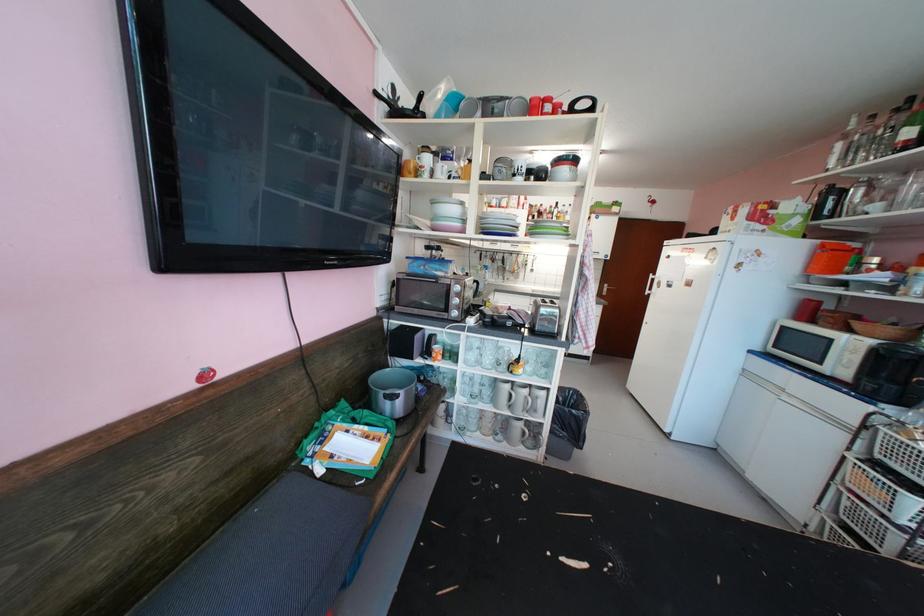
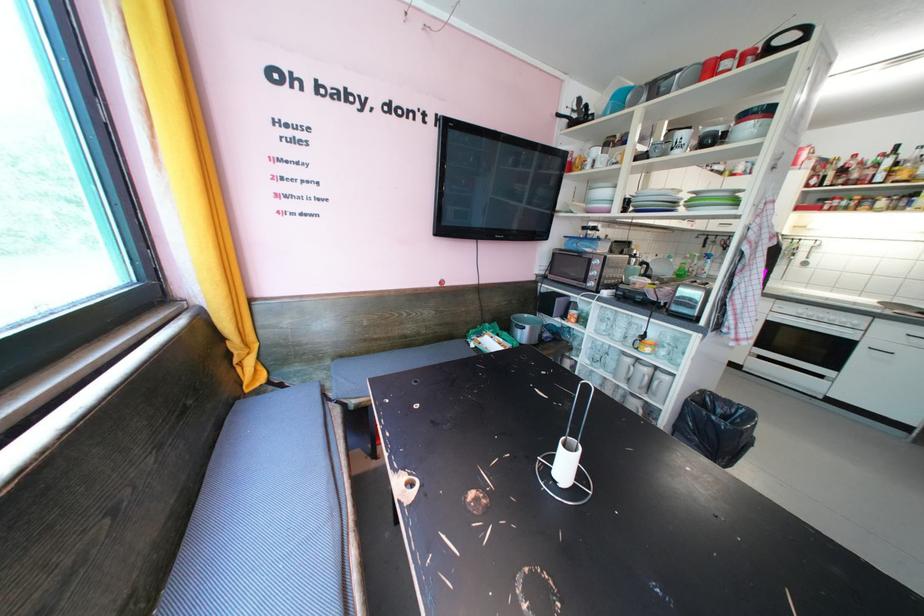
Find the pixel in the second image that matches [518,416] in the first image.

(635, 390)